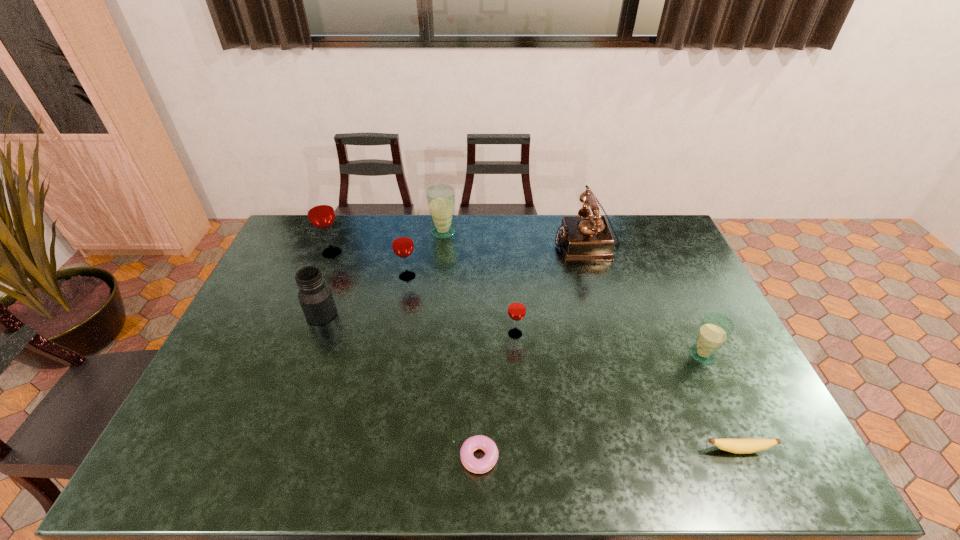
The width and height of the screenshot is (960, 540). In order to click on the rightmost glass in this screenshot , I will do `click(715, 329)`.

You are a GUI agent. You are given a task and a screenshot of the screen. Output one action in this format:
    pyautogui.click(x=<x>, y=<y>)
    Task: Click on the second glass from right to left
    
    Given the screenshot: What is the action you would take?
    pyautogui.click(x=517, y=305)

This screenshot has width=960, height=540. Identify the location of the smallest red glass. click(x=517, y=305).

In order to click on yellow banana in this screenshot , I will do `click(738, 446)`.

I want to click on the eighth tallest object, so pyautogui.click(x=738, y=446).

At what (x,y) coordinates should I click in order to perform the action: click on the fifth object from left to right. Please return your answer as a coordinate pair (x, y). Looking at the image, I should click on (483, 465).

At what (x,y) coordinates should I click in order to perform the action: click on the shortest object. Please return your answer as a coordinate pair (x, y). Looking at the image, I should click on (483, 465).

Where is `vacant space located 0.120m on the back of the biggest red glass`? This screenshot has width=960, height=540. vacant space located 0.120m on the back of the biggest red glass is located at coordinates (343, 226).

Locate an element on the screen. The image size is (960, 540). vacant space located 0.170m on the dial of the brown telephone is located at coordinates (509, 243).

Where is `free spot located on the dial of the brown telephone`? free spot located on the dial of the brown telephone is located at coordinates (x=506, y=243).